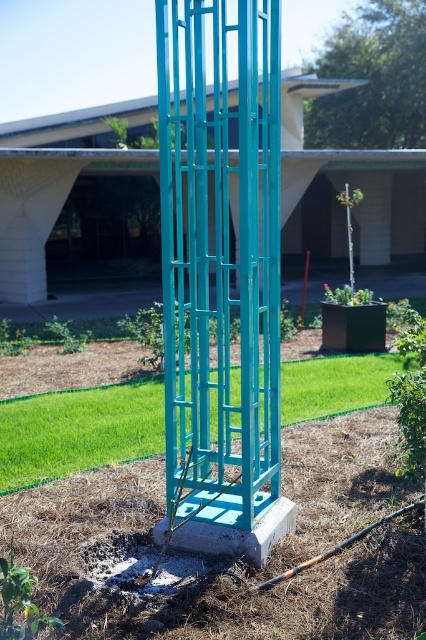
Question: Which of the following is the farthest from the observer?

Choices:
 (A) (259, 410)
 (B) (51, 410)

Answer: (B)

Question: Which point is farther to the camera?

Choices:
 (A) green grass at center
 (B) teal metal trellis at center

Answer: (A)

Question: Is teal metal trellis at center further to camera compared to green grass at center?

Choices:
 (A) no
 (B) yes

Answer: (A)

Question: Which point is farther to the camera?

Choices:
 (A) green grass at center
 (B) teal metal trellis at center

Answer: (A)

Question: Can you confirm if teal metal trellis at center is bigger than green grass at center?

Choices:
 (A) yes
 (B) no

Answer: (A)

Question: Where is teal metal trellis at center located in relation to green grass at center in the image?

Choices:
 (A) left
 (B) right

Answer: (A)